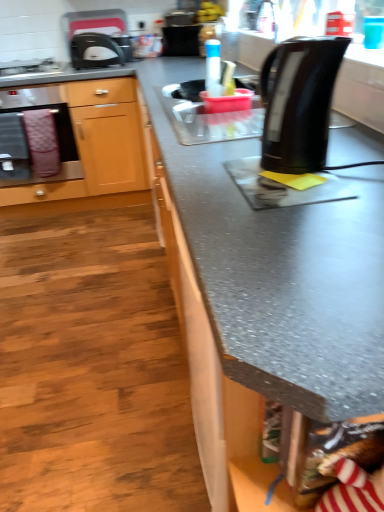
Where is `free space to the left of black glossy electric kettle at right`? free space to the left of black glossy electric kettle at right is located at coordinates (216, 169).